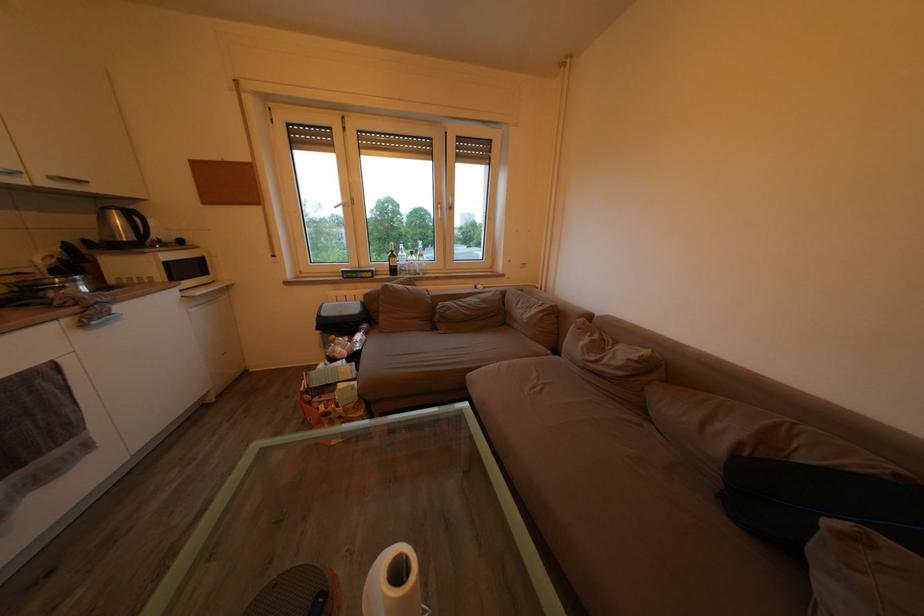
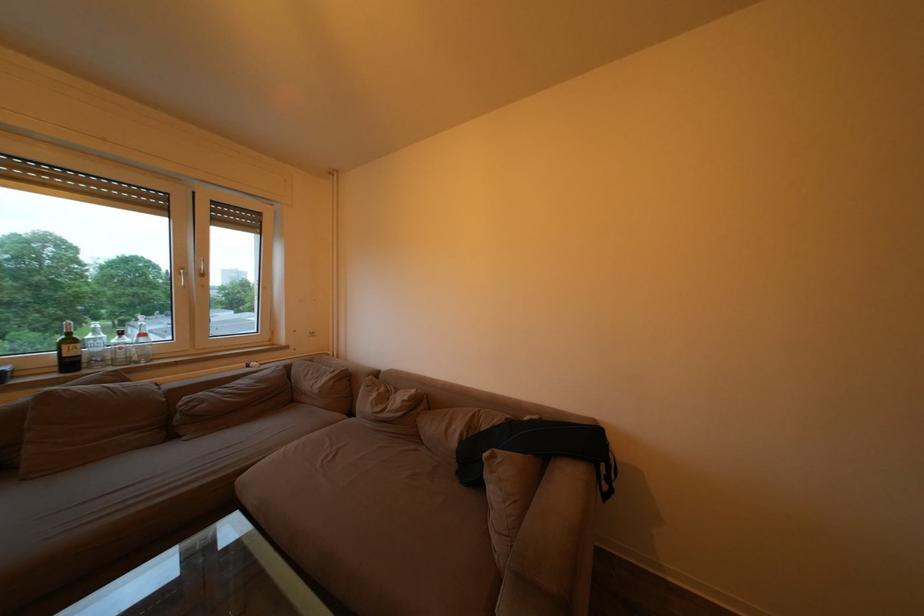
The point at (410, 269) is marked in the first image. Where is the corresponding point in the second image?

(107, 355)